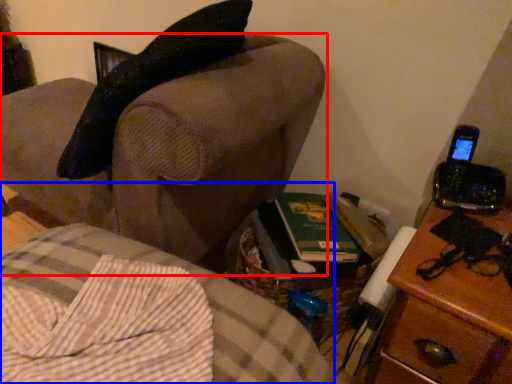
Question: Which object is closer to the camera taking this photo, furniture (highlighted by a red box) or furniture (highlighted by a blue box)?

Choices:
 (A) furniture
 (B) furniture

Answer: (B)